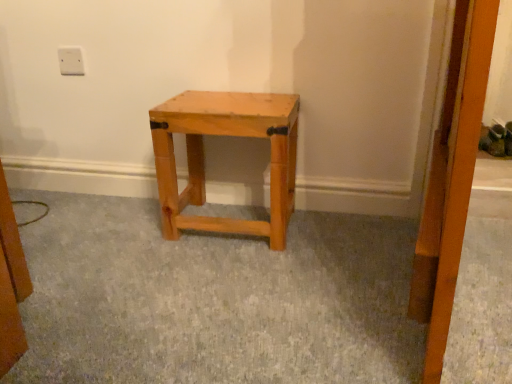
Image resolution: width=512 pixels, height=384 pixels. In order to click on natural wood stool at center in this screenshot , I will do pos(225,135).

Measure the distance between point [271,212] and camera.

1.13 meters.

What do you see at coordinates (225, 135) in the screenshot?
I see `natural wood stool at center` at bounding box center [225, 135].

This screenshot has width=512, height=384. Describe the element at coordinates (71, 61) in the screenshot. I see `white plastic outlet at upper left` at that location.

The width and height of the screenshot is (512, 384). I want to click on white plastic outlet at upper left, so pyautogui.click(x=71, y=61).

Find the location of `natural wood stool at center`. natural wood stool at center is located at coordinates (225, 135).

Which object is positioned more to the left, natural wood stool at center or white plastic outlet at upper left?

white plastic outlet at upper left is more to the left.

Which object is more forward, natural wood stool at center or white plastic outlet at upper left?

Positioned in front is natural wood stool at center.

Does point (272, 233) appear closer or farther from the camera than point (62, 66)?

Point (272, 233) is positioned closer to the camera compared to point (62, 66).

Based on the photo, from the image's perspective, would you say natural wood stool at center is positioned over white plastic outlet at upper left?

No, from the image's perspective, natural wood stool at center is not over white plastic outlet at upper left.

From a real-world perspective, which is physically above, natural wood stool at center or white plastic outlet at upper left?

white plastic outlet at upper left, from a real-world perspective.

Which object is thinner, natural wood stool at center or white plastic outlet at upper left?

white plastic outlet at upper left is thinner.

In the scene shown: Considering the sizes of natural wood stool at center and white plastic outlet at upper left in the image, is natural wood stool at center taller or shorter than white plastic outlet at upper left?

Clearly, natural wood stool at center is taller compared to white plastic outlet at upper left.

Considering the relative sizes of natural wood stool at center and white plastic outlet at upper left in the image provided, is natural wood stool at center bigger than white plastic outlet at upper left?

Indeed, natural wood stool at center has a larger size compared to white plastic outlet at upper left.

From the picture: Would you say natural wood stool at center is inside or outside white plastic outlet at upper left?

natural wood stool at center exists outside the volume of white plastic outlet at upper left.

Are natural wood stool at center and white plastic outlet at upper left beside each other?

natural wood stool at center is not next to white plastic outlet at upper left, and they're not touching.

Is white plastic outlet at upper left at the back of natural wood stool at center?

No, natural wood stool at center is not facing the opposite direction of white plastic outlet at upper left.

What's the angular difference between natural wood stool at center and white plastic outlet at upper left's facing directions?

0.823 degrees separate the facing orientations of natural wood stool at center and white plastic outlet at upper left.

How far apart are natural wood stool at center and white plastic outlet at upper left?

natural wood stool at center is 24.31 inches away from white plastic outlet at upper left.

Locate an element on the screen. This screenshot has height=384, width=512. electric outlet that appears above the natural wood stool at center (from the image's perspective) is located at coordinates (71, 61).

Which object is positioned more to the right, white plastic outlet at upper left or natural wood stool at center?

From the viewer's perspective, natural wood stool at center appears more on the right side.

Considering the relative positions of white plastic outlet at upper left and natural wood stool at center in the image provided, is white plastic outlet at upper left in front of natural wood stool at center?

No, white plastic outlet at upper left is further to the viewer.

Is point (58, 56) in front of point (191, 173)?

Yes.

From the image's perspective, which object appears higher, white plastic outlet at upper left or natural wood stool at center?

white plastic outlet at upper left appears higher in the image.

From a real-world perspective, is white plastic outlet at upper left physically located above or below natural wood stool at center?

white plastic outlet at upper left is above natural wood stool at center.

Which of these two, white plastic outlet at upper left or natural wood stool at center, is wider?

Wider between the two is natural wood stool at center.

Is white plastic outlet at upper left taller than natural wood stool at center?

In fact, white plastic outlet at upper left may be shorter than natural wood stool at center.

Can you confirm if white plastic outlet at upper left is bigger than natural wood stool at center?

No, white plastic outlet at upper left is not bigger than natural wood stool at center.

Is white plastic outlet at upper left inside the boundaries of natural wood stool at center, or outside?

white plastic outlet at upper left is outside natural wood stool at center.

Are white plastic outlet at upper left and natural wood stool at center making contact?

They are not placed beside each other.

Is white plastic outlet at upper left facing towards natural wood stool at center?

No.

Locate an element on the screen. stool in front of the white plastic outlet at upper left is located at coordinates (225, 135).

Where is `stool in front of the white plastic outlet at upper left`? stool in front of the white plastic outlet at upper left is located at coordinates (225, 135).

The width and height of the screenshot is (512, 384). Identify the location of electric outlet on the left side of natural wood stool at center. (71, 61).